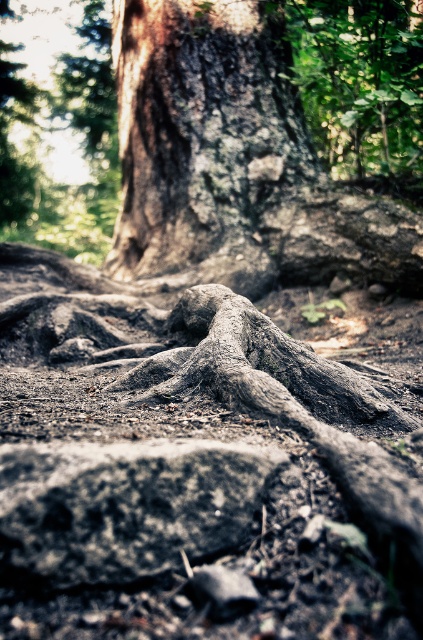
Question: Which object appears farthest from the camera in this image?

Choices:
 (A) smooth gray rock at center
 (B) dark brown rough bark at center

Answer: (B)

Question: Which point is farther to the camera?

Choices:
 (A) (10, 568)
 (B) (337, 428)
 (C) (222, 180)

Answer: (C)

Question: Which of the following is the farthest from the observer?

Choices:
 (A) (321, 403)
 (B) (30, 529)

Answer: (A)

Question: Where is dark brown rough bark at center located in relation to smooth gray rock at center in the image?

Choices:
 (A) left
 (B) right

Answer: (A)

Question: Can you confirm if smooth gray rock at center is thinner than gray textured roots at center?

Choices:
 (A) no
 (B) yes

Answer: (B)

Question: Can you confirm if dark brown rough bark at center is positioned to the left of gray textured roots at center?

Choices:
 (A) yes
 (B) no

Answer: (A)